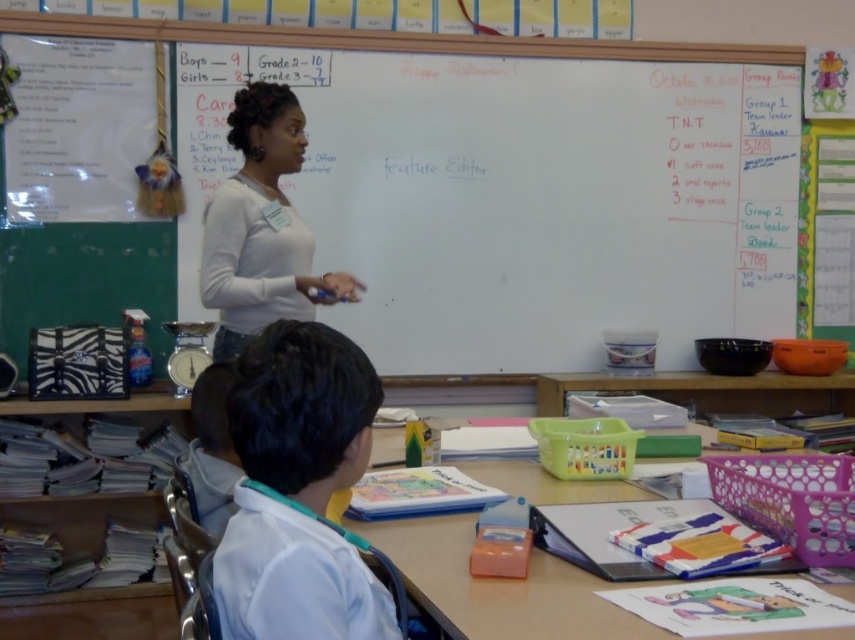
Question: Can you confirm if whiteboard at upper center is positioned to the left of white smooth shirt at lower left?

Choices:
 (A) yes
 (B) no

Answer: (B)

Question: Estimate the real-world distances between objects in this image. Which object is farther from the white smooth shirt at lower left?

Choices:
 (A) white matte shirt at center
 (B) whiteboard at upper center

Answer: (B)

Question: Among these objects, which one is farthest from the camera?

Choices:
 (A) white matte shirt at center
 (B) white smooth shirt at lower left

Answer: (A)

Question: Considering the real-world distances, which object is closest to the whiteboard at upper center?

Choices:
 (A) white smooth shirt at lower left
 (B) white matte shirt at center

Answer: (B)

Question: Can you confirm if whiteboard at upper center is smaller than white smooth shirt at lower left?

Choices:
 (A) no
 (B) yes

Answer: (A)

Question: Can you confirm if white smooth shirt at lower left is wider than white matte shirt at center?

Choices:
 (A) no
 (B) yes

Answer: (A)